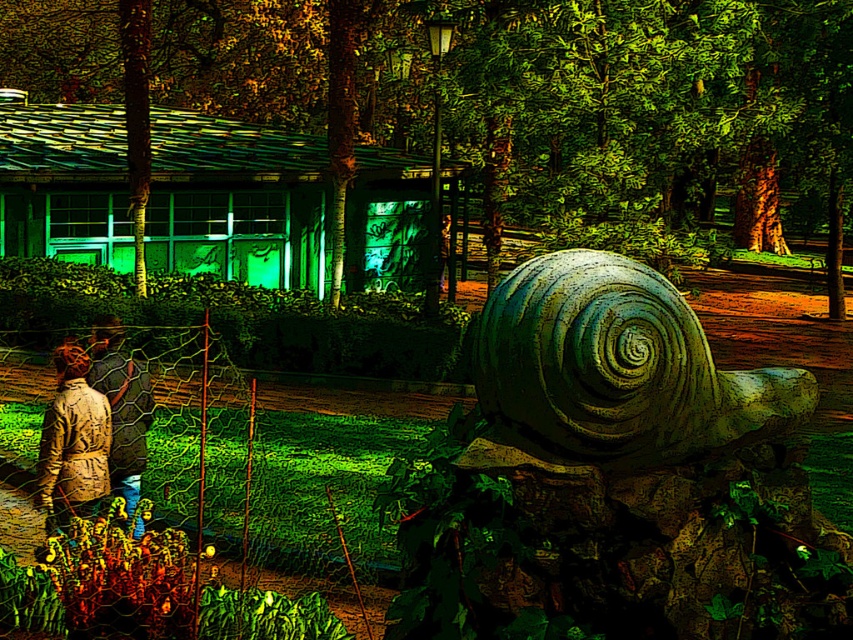
Question: Which object is positioned farthest from the camouflage-patterned jacket at lower left?

Choices:
 (A) greenish marble snail at center
 (B) camouflage jacket at lower left

Answer: (A)

Question: From the image, what is the correct spatial relationship of greenish marble snail at center in relation to camouflage jacket at lower left?

Choices:
 (A) right
 (B) left

Answer: (A)

Question: Which object is the farthest from the greenish marble snail at center?

Choices:
 (A) camouflage-patterned jacket at lower left
 (B) camouflage jacket at lower left

Answer: (B)

Question: Does greenish marble snail at center have a larger size compared to camouflage-patterned jacket at lower left?

Choices:
 (A) yes
 (B) no

Answer: (A)

Question: Can you confirm if greenish marble snail at center is positioned below camouflage jacket at lower left?

Choices:
 (A) yes
 (B) no

Answer: (B)

Question: Among these objects, which one is nearest to the camera?

Choices:
 (A) greenish marble snail at center
 (B) camouflage jacket at lower left
 (C) camouflage-patterned jacket at lower left

Answer: (A)